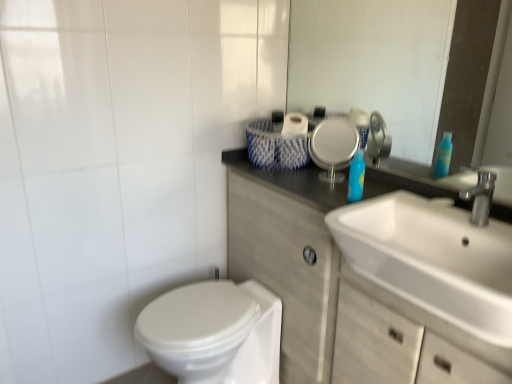
Question: Considering the relative positions of glossy glass mirror at upper center and white glossy sink at right in the image provided, is glossy glass mirror at upper center to the right of white glossy sink at right from the viewer's perspective?

Choices:
 (A) no
 (B) yes

Answer: (A)

Question: Is glossy glass mirror at upper center facing away from white glossy sink at right?

Choices:
 (A) no
 (B) yes

Answer: (A)

Question: Is glossy glass mirror at upper center directly adjacent to white glossy sink at right?

Choices:
 (A) yes
 (B) no

Answer: (B)

Question: From the image's perspective, would you say glossy glass mirror at upper center is shown under white glossy sink at right?

Choices:
 (A) no
 (B) yes

Answer: (A)

Question: Can white glossy sink at right be found inside glossy glass mirror at upper center?

Choices:
 (A) yes
 (B) no

Answer: (B)

Question: From the image's perspective, is white glossy sink at right above or below white matte cabinet at center?

Choices:
 (A) below
 (B) above

Answer: (B)

Question: Considering their positions, is white glossy sink at right located in front of or behind white matte cabinet at center?

Choices:
 (A) behind
 (B) front

Answer: (B)

Question: Considering the positions of white glossy sink at right and white matte cabinet at center in the image, is white glossy sink at right bigger or smaller than white matte cabinet at center?

Choices:
 (A) big
 (B) small

Answer: (B)

Question: Would you say white glossy sink at right is inside or outside white matte cabinet at center?

Choices:
 (A) outside
 (B) inside

Answer: (B)

Question: Considering their positions, is white woven basket at upper center located in front of or behind glossy glass mirror at upper center?

Choices:
 (A) front
 (B) behind

Answer: (B)

Question: In terms of height, does white woven basket at upper center look taller or shorter compared to glossy glass mirror at upper center?

Choices:
 (A) short
 (B) tall

Answer: (A)

Question: In terms of width, does white woven basket at upper center look wider or thinner when compared to glossy glass mirror at upper center?

Choices:
 (A) thin
 (B) wide

Answer: (B)

Question: Would you say white woven basket at upper center is inside or outside glossy glass mirror at upper center?

Choices:
 (A) inside
 (B) outside

Answer: (B)

Question: From a real-world perspective, is blue glossy bottle at upper right physically located above or below white glossy bidet at lower left?

Choices:
 (A) above
 (B) below

Answer: (A)

Question: Relative to white glossy bidet at lower left, is blue glossy bottle at upper right in front or behind?

Choices:
 (A) front
 (B) behind

Answer: (B)